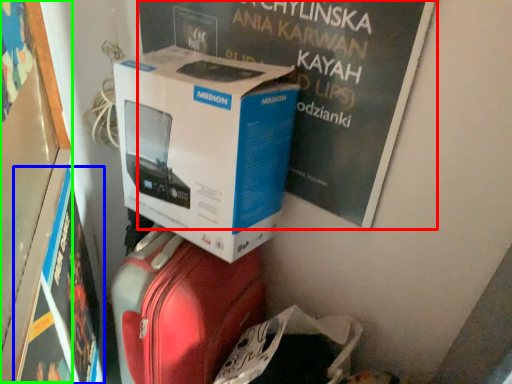
Question: Considering the real-world distances, which object is farthest from magazine (highlighted by a red box)? magazine (highlighted by a blue box) or bulletin board (highlighted by a green box)?

Choices:
 (A) magazine
 (B) bulletin board

Answer: (A)